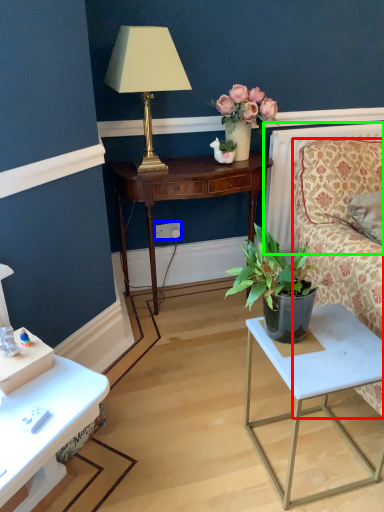
Question: Considering the real-world distances, which object is farthest from studio couch (highlighted by a red box)? power outlet (highlighted by a blue box) or radiator (highlighted by a green box)?

Choices:
 (A) power outlet
 (B) radiator

Answer: (A)